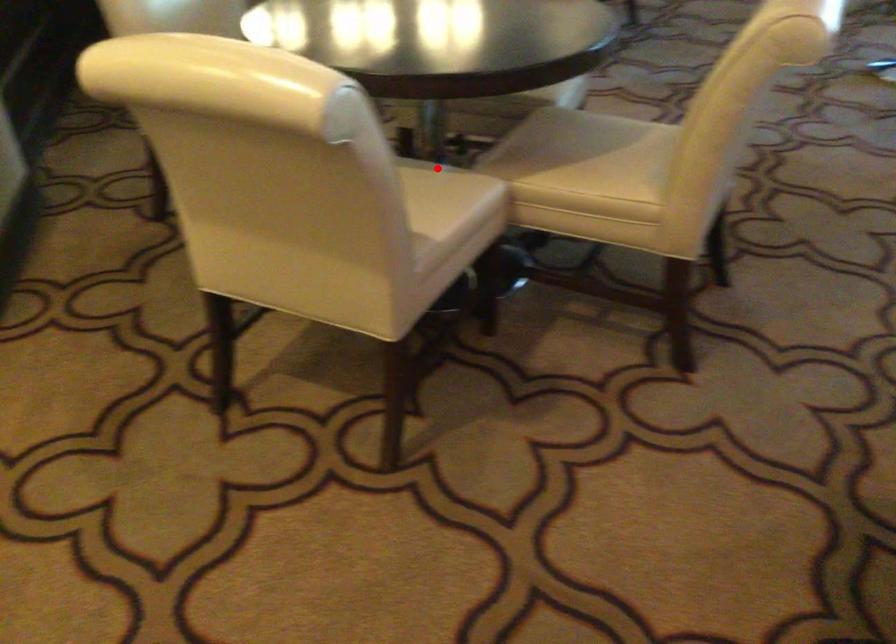
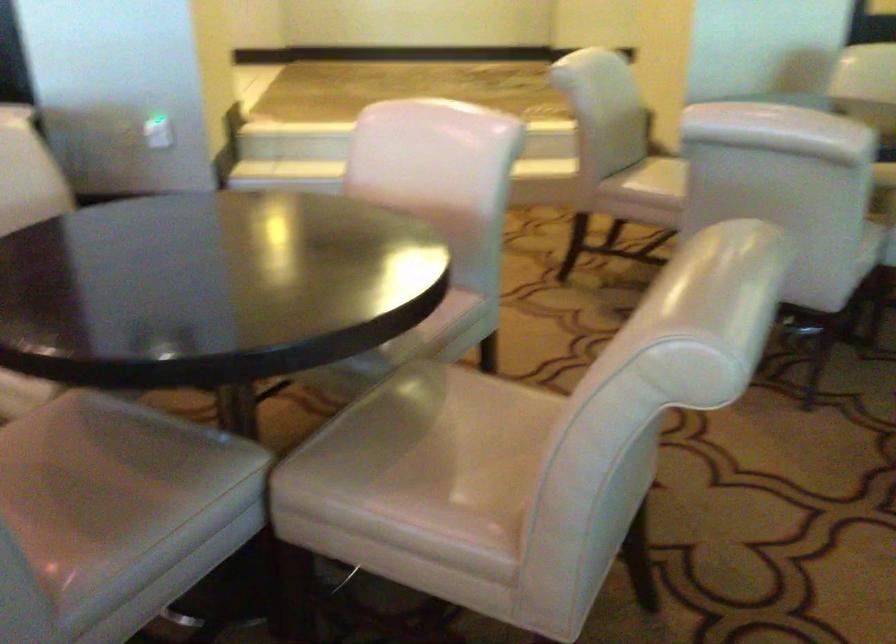
Question: I am providing you with two images of the same scene from different viewpoints. A red point is marked on the first image. Is the red point's position out of view in image 2?

Choices:
 (A) Yes
 (B) No

Answer: (A)